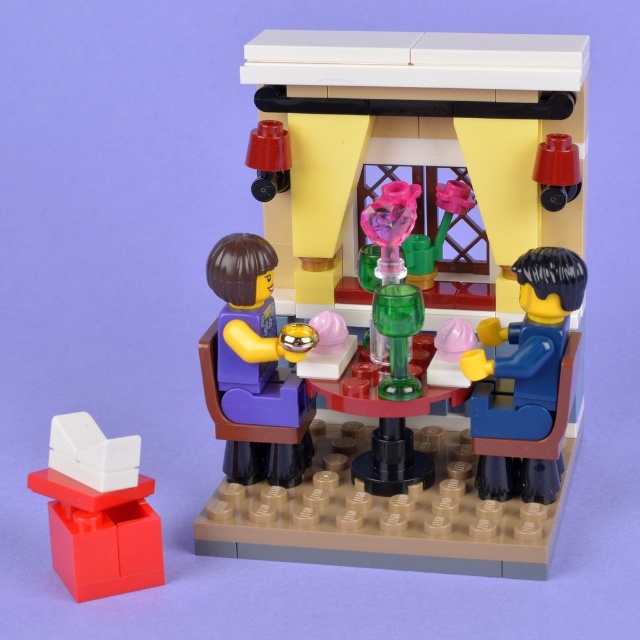
Can you confirm if purple matte/vinyl figure at center is positioned to the right of white plastic chair at lower left?

Yes, purple matte/vinyl figure at center is to the right of white plastic chair at lower left.

Which of these two, purple matte/vinyl figure at center or white plastic chair at lower left, stands taller?

Standing taller between the two is purple matte/vinyl figure at center.

Is point (240, 387) in front of point (97, 456)?

No, it is behind (97, 456).

The height and width of the screenshot is (640, 640). Find the location of `purple matte/vinyl figure at center`. purple matte/vinyl figure at center is located at coordinates (253, 369).

Consider the image. Does matte green vase at center appear over white plastic chair at lower left?

Yes, matte green vase at center is above white plastic chair at lower left.

Is matte green vase at center shorter than white plastic chair at lower left?

No.

Is point (557, 509) in front of point (88, 472)?

No.

What are the coordinates of `matte green vase at center` in the screenshot? It's located at (416, 150).

Between matte green vase at center and blue matte figure at right, which one is positioned lower?

blue matte figure at right

Is matte green vase at center thinner than blue matte figure at right?

Incorrect, matte green vase at center's width is not less than blue matte figure at right's.

Does point (324, 148) come closer to viewer compared to point (545, 406)?

No, it is not.

Identify the location of matte green vase at center. (416, 150).